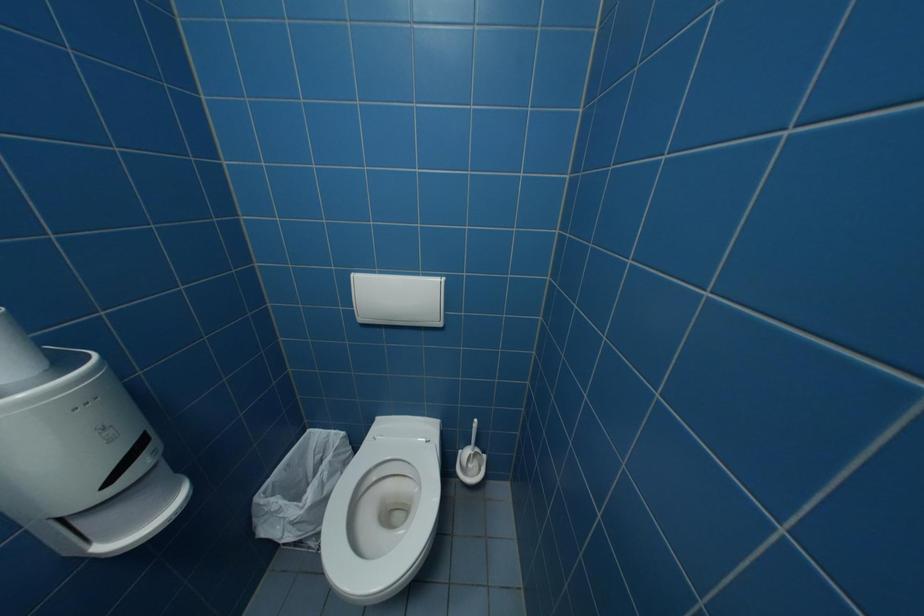
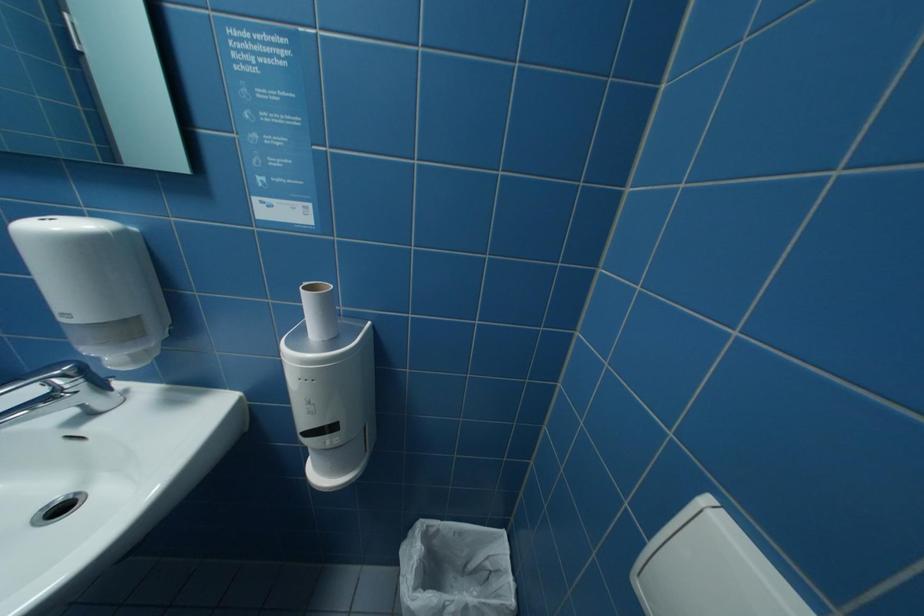
Looking at this image, first-person continuous shooting, in which direction is the camera rotating?

The camera's rotation is toward left-down.